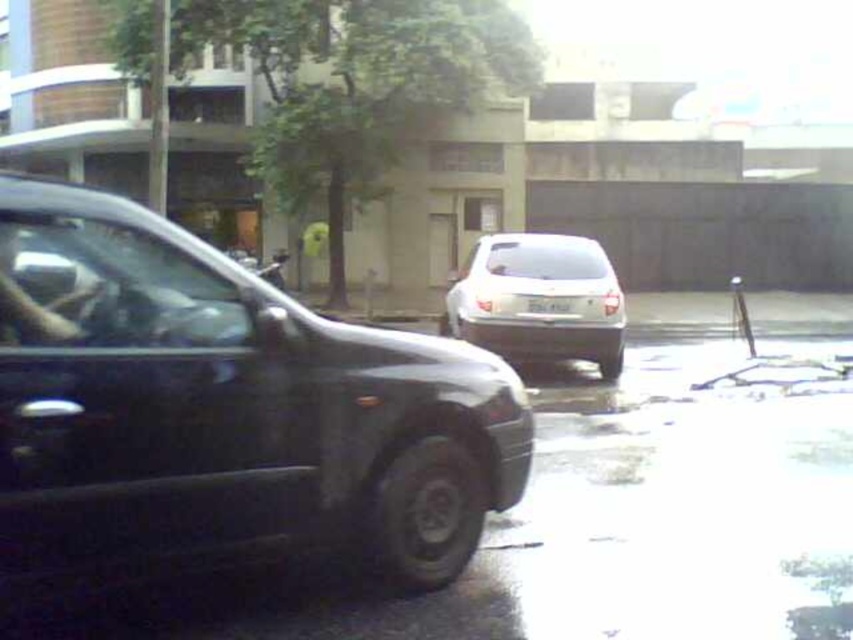
You are a delivery person trying to attach a magnetic parcel to the white plastic license plate at center on the satin white suv at center. The magnetic parcel requires a minimum of 10 inches of clear space around it to avoid interference. Can you safely attach it there?

The distance between the satin white suv at center and the white plastic license plate at center is 12.40 inches, which is more than the required 10 inches of clear space. Therefore, you can safely attach the magnetic parcel to the white plastic license plate at center.

You are standing at the center of the road and want to walk to the shiny black sedan at left. Which direction should you walk?

You should walk to the left because the shiny black sedan at left is located at point (222, 412), which is to the left of the center of the road.

You are a delivery person trying to deliver a package to the address located on the white plastic license plate at center. However, you notice another vehicle, the satin white suv at center, blocking the path. Can you still reach the license plate to deliver the package?

The satin white suv at center is further to the viewer than the white plastic license plate at center, so the license plate is closer to you. Therefore, you can reach the white plastic license plate at center to deliver the package despite the suv being in front.